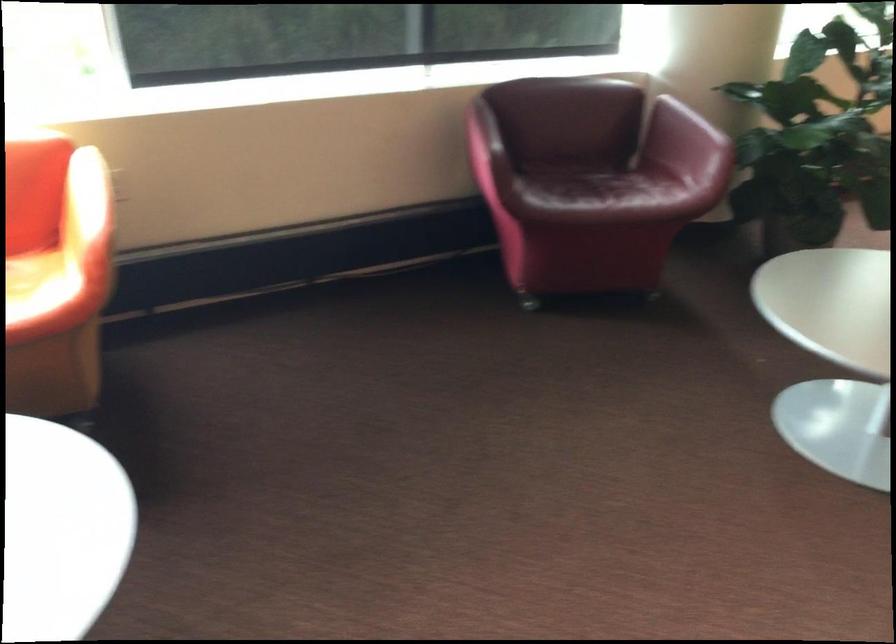
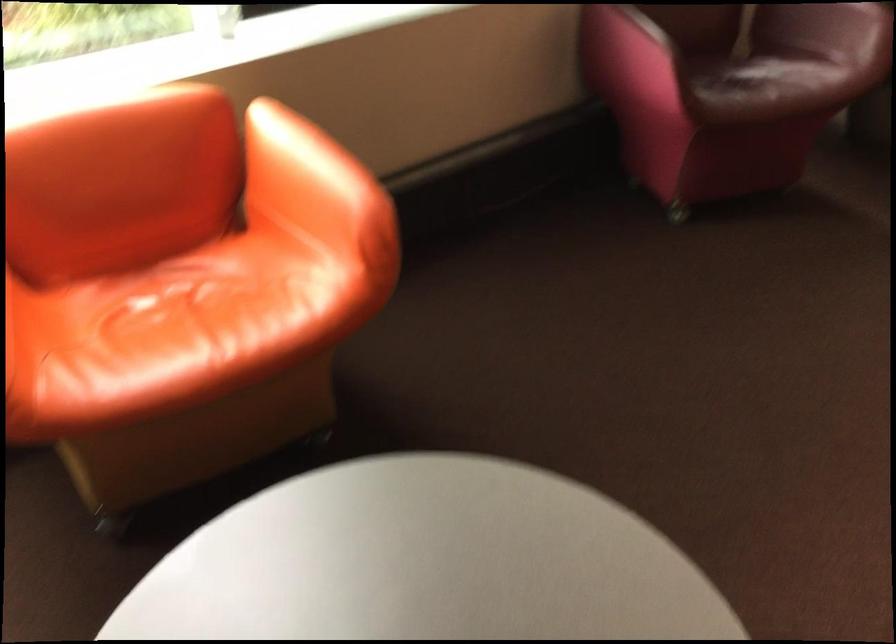
Question: Which direction would the cameraman need to move to produce the second image? Reply with the corresponding letter.

Choices:
 (A) Left
 (B) Right
 (C) Forward
 (D) Backward

Answer: (A)